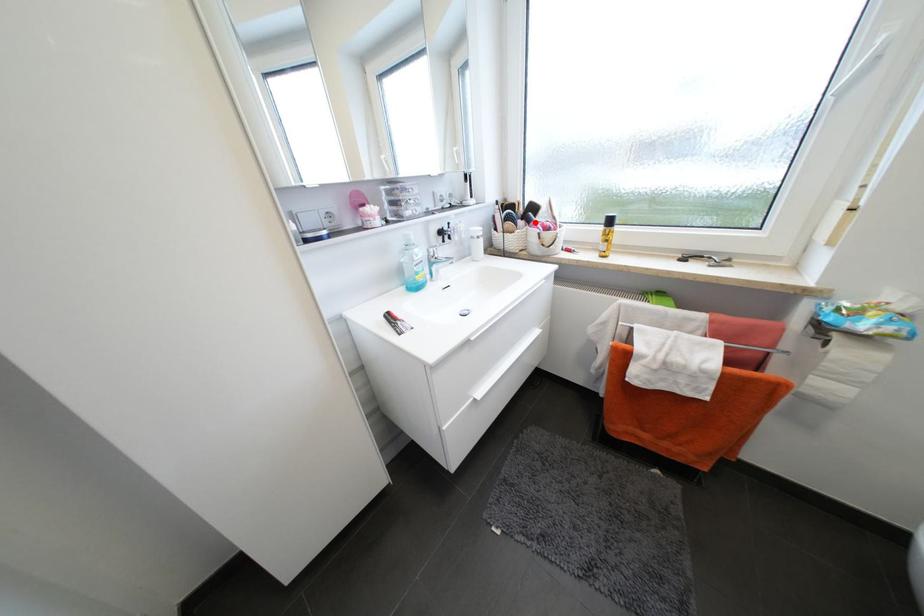
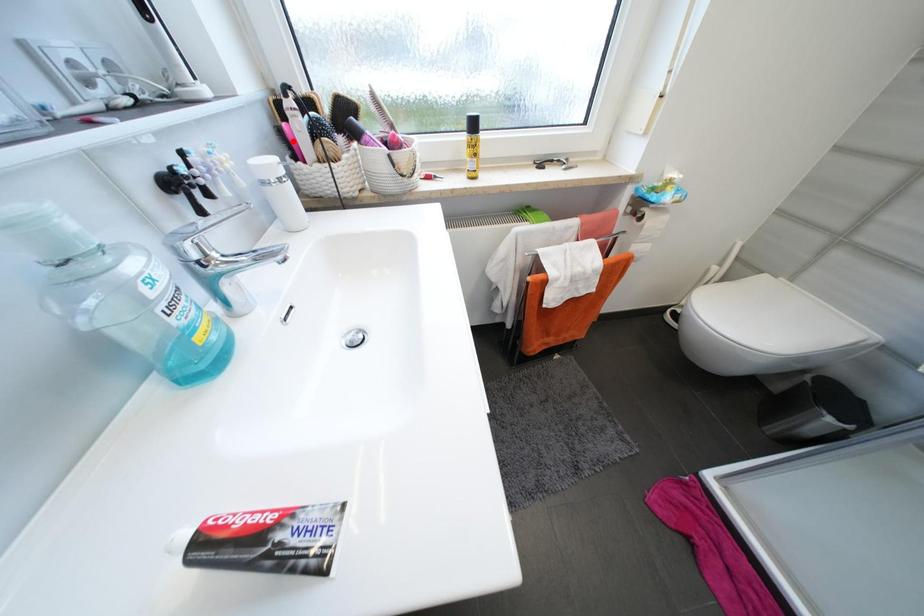
I am providing you with two images of the same scene from different viewpoints. A red point is marked on the first image and another point is marked on the second image. Is the red point in image1 aligned with the point shown in image2?

No